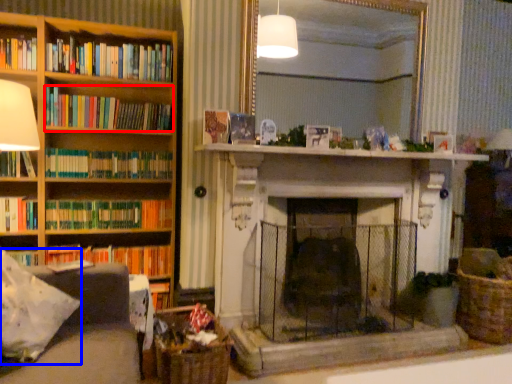
Question: Which point is further to the camera, book (highlighted by a red box) or pillow (highlighted by a blue box)?

Choices:
 (A) book
 (B) pillow

Answer: (A)